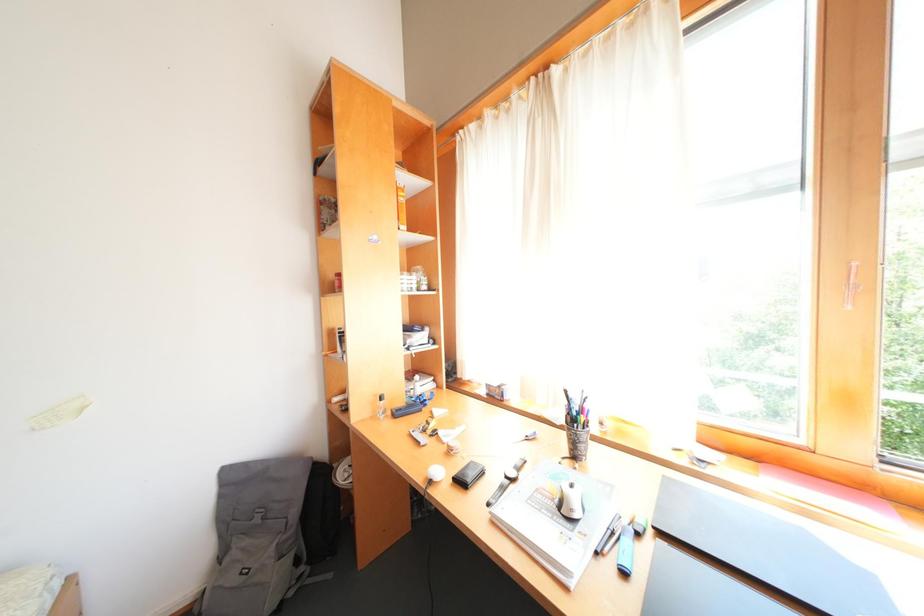
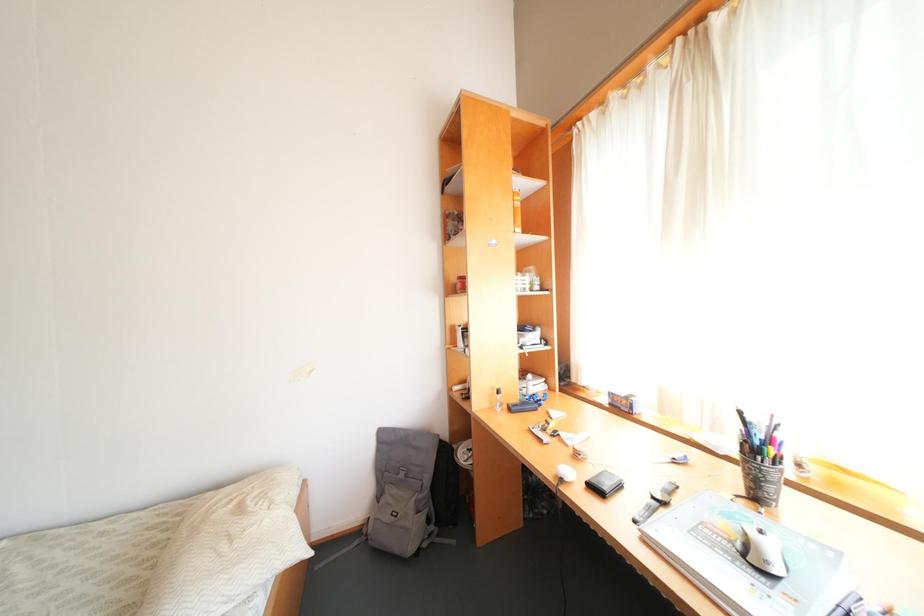
Question: Based on the continuous images, in which direction is the camera rotating? Reply with the corresponding letter.

Choices:
 (A) Left
 (B) Right
 (C) Up
 (D) Down

Answer: (A)